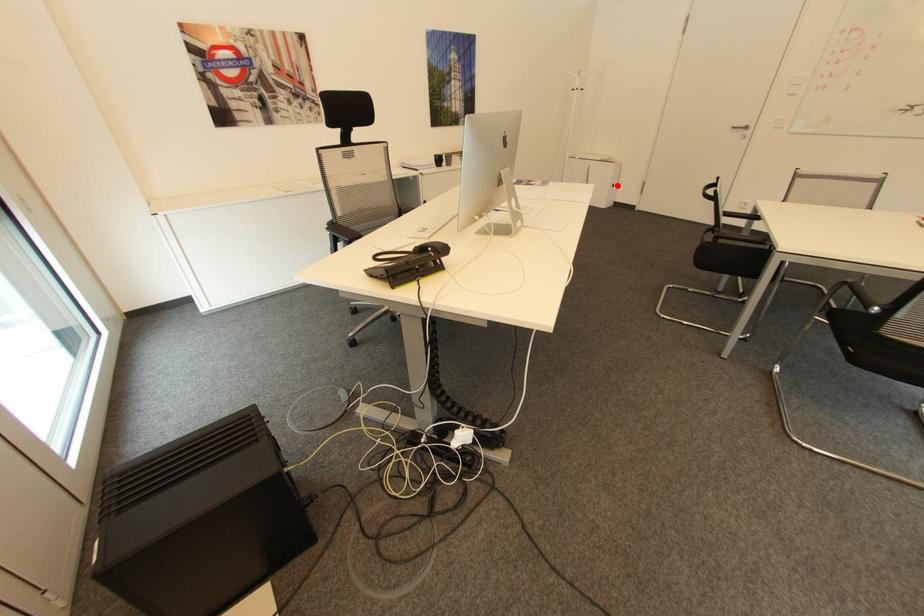
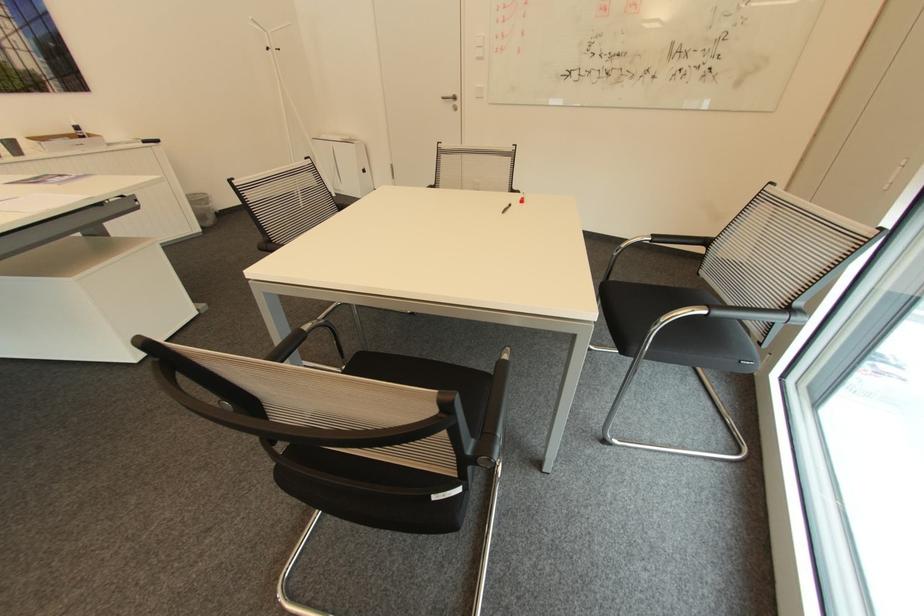
Question: A red point is marked in image1. In image2, is the corresponding 3D point closer to the camera or farther? Reply with the corresponding letter.

Choices:
 (A) The corresponding 3D point is closer.
 (B) The corresponding 3D point is farther.

Answer: (B)